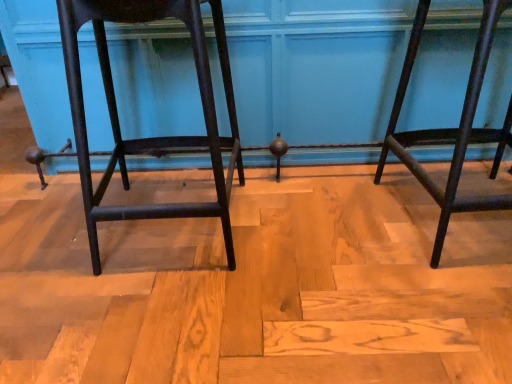
The image size is (512, 384). I want to click on free space below matte black stool at left, positioned as the 2th furniture in right-to-left order (from a real-world perspective), so click(176, 220).